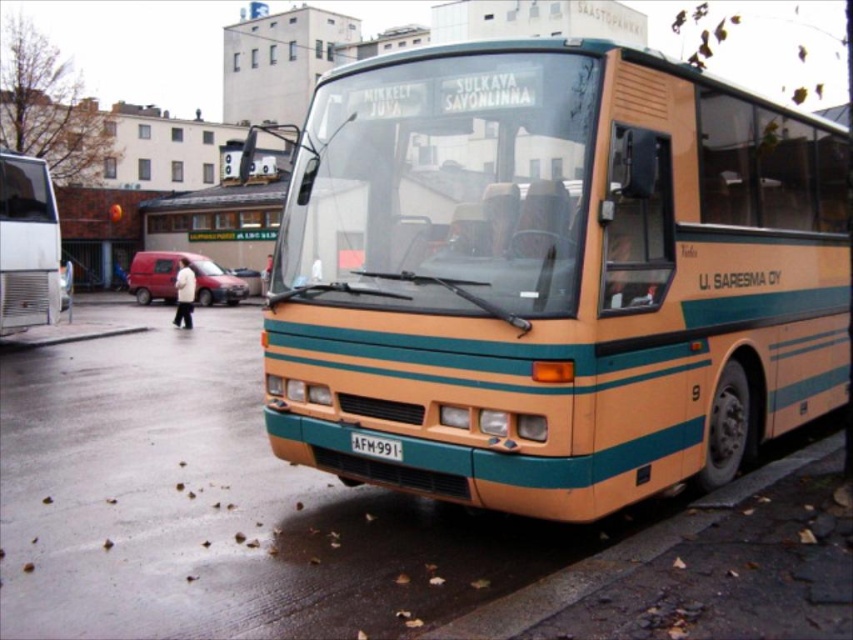
Is matte orange bus at center bigger than white plastic license plate at center?

Yes, matte orange bus at center is bigger than white plastic license plate at center.

Which is in front, point (480, 420) or point (367, 452)?

Point (480, 420) is in front.

I want to click on matte orange bus at center, so tap(552, 275).

This screenshot has width=853, height=640. Describe the element at coordinates (27, 244) in the screenshot. I see `metallic silver bus at left` at that location.

Does metallic silver bus at left have a larger size compared to white plastic license plate at center?

Correct, metallic silver bus at left is larger in size than white plastic license plate at center.

Find the location of a particular element. metallic silver bus at left is located at coordinates (27, 244).

Is matte orange bus at center positioned at the back of metallic silver bus at left?

No, it is in front of metallic silver bus at left.

Can you confirm if matte orange bus at center is positioned below metallic silver bus at left?

No.

Does point (718, 404) come farther from viewer compared to point (38, 220)?

No, (718, 404) is closer to viewer.

Where is `matte orange bus at center`? This screenshot has width=853, height=640. matte orange bus at center is located at coordinates 552,275.